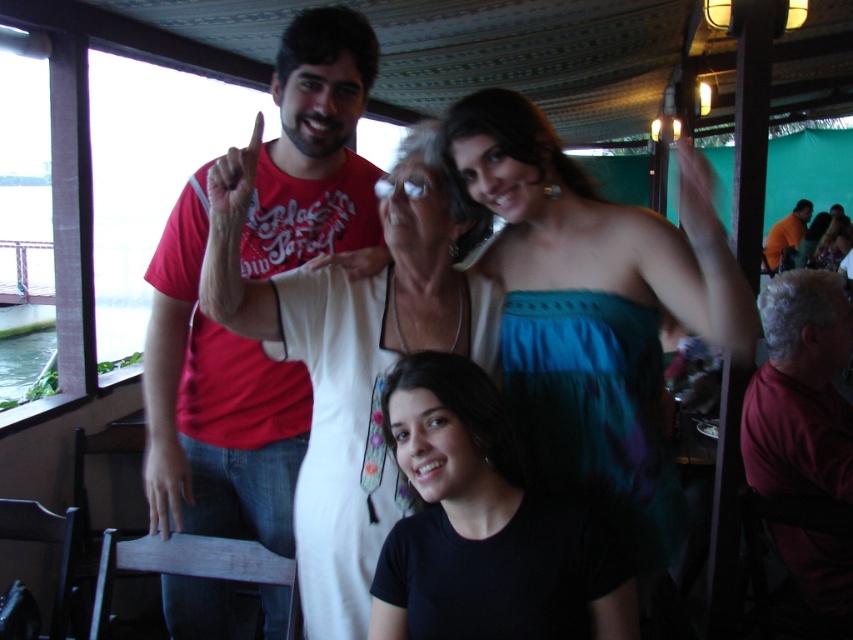
You are standing in a restaurant and want to take a photo of the group at point (268, 524). The photographer says you need to be at least 5 feet away to capture everyone clearly. Can you take the photo from your current position?

The distance between you and the point (268, 524) is 6.09 feet, which is more than the required 5 feet. Therefore, you can take the photo from your current position.

You are a photographer trying to adjust the composition of this group photo. You notice the black matte shirt at center and the orange fabric shirt at upper right. Which of these two items appears shorter in the photo?

The black matte shirt at center appears shorter compared to the orange fabric shirt at upper right.

Consider the image. You are a photographer trying to adjust the lighting for a group photo. You need to ensure that the dark red shirt at lower right and the orange fabric shirt at upper right are both well lit. Since one is taller than the other, which shirt should you adjust the lighting for first to ensure proper exposure?

The dark red shirt at lower right is taller than the orange fabric shirt at upper right, so you should adjust the lighting for the dark red shirt at lower right first to ensure proper exposure.